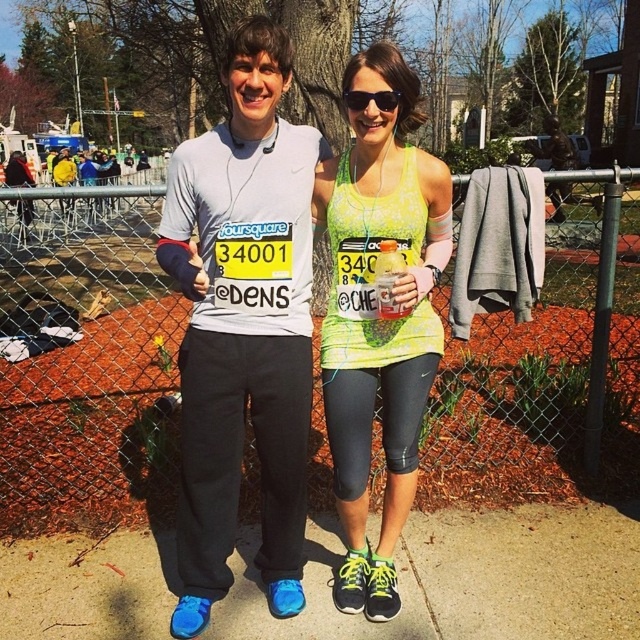
In the scene shown: Can you confirm if smooth concrete pavement at center is positioned to the right of neon yellow tank top at center?

No, smooth concrete pavement at center is not to the right of neon yellow tank top at center.

Does smooth concrete pavement at center have a lesser width compared to neon yellow tank top at center?

No, smooth concrete pavement at center is not thinner than neon yellow tank top at center.

Where is `smooth concrete pavement at center`? This screenshot has height=640, width=640. smooth concrete pavement at center is located at coordinates (468, 579).

Is smooth concrete pavement at center thinner than black plastic sunglasses at center?

In fact, smooth concrete pavement at center might be wider than black plastic sunglasses at center.

Does smooth concrete pavement at center lie behind black plastic sunglasses at center?

Yes, smooth concrete pavement at center is behind black plastic sunglasses at center.

Locate an element on the screen. The height and width of the screenshot is (640, 640). smooth concrete pavement at center is located at coordinates (468, 579).

Who is positioned more to the left, metal chain-link fence at center or neon yellow tank top at center?

metal chain-link fence at center is more to the left.

What do you see at coordinates (86, 365) in the screenshot? I see `metal chain-link fence at center` at bounding box center [86, 365].

Image resolution: width=640 pixels, height=640 pixels. What are the coordinates of `metal chain-link fence at center` in the screenshot? It's located at (x=86, y=365).